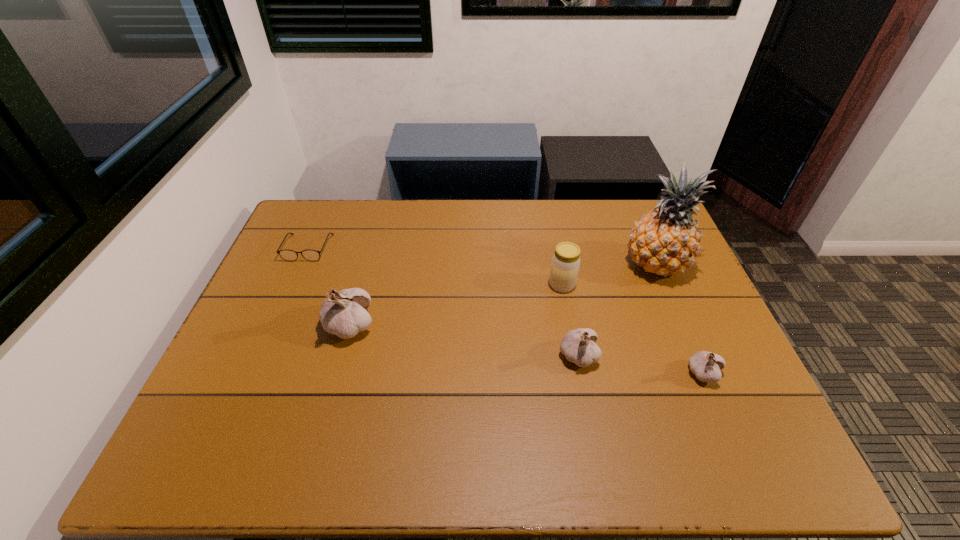
Identify the location of vacant space in between the leftmost garlic and the tallest object. The image size is (960, 540). (503, 295).

The width and height of the screenshot is (960, 540). Find the location of `vacant point located between the pineapple and the spectacles`. vacant point located between the pineapple and the spectacles is located at coordinates (482, 256).

This screenshot has height=540, width=960. I want to click on free space between the rightmost garlic and the spectacles, so click(506, 310).

Where is `free area in between the second garlic from left to right and the tallest object`? Image resolution: width=960 pixels, height=540 pixels. free area in between the second garlic from left to right and the tallest object is located at coordinates (617, 310).

The height and width of the screenshot is (540, 960). I want to click on free point between the second garlic from right to left and the second object from left to right, so click(464, 341).

Identify which object is the second closest to the second garlic from right to left. Please provide its 2D coordinates. Your answer should be formatted as a tuple, i.e. [(x, y)], where the tuple contains the x and y coordinates of a point satisfying the conditions above.

[(706, 366)]

Identify the location of object that stands as the fifth closest to the leftmost object. (706, 366).

Locate an element on the screen. This screenshot has height=540, width=960. garlic object that ranks as the closest to the pineapple is located at coordinates (579, 347).

Select which garlic is the second closest to the rightmost garlic. Please provide its 2D coordinates. Your answer should be formatted as a tuple, i.e. [(x, y)], where the tuple contains the x and y coordinates of a point satisfying the conditions above.

[(343, 313)]

Identify the location of free spot that satisfies the following two spatial constraints: 1. on the front side of the second shortest garlic; 2. on the right side of the jar. This screenshot has height=540, width=960. (575, 356).